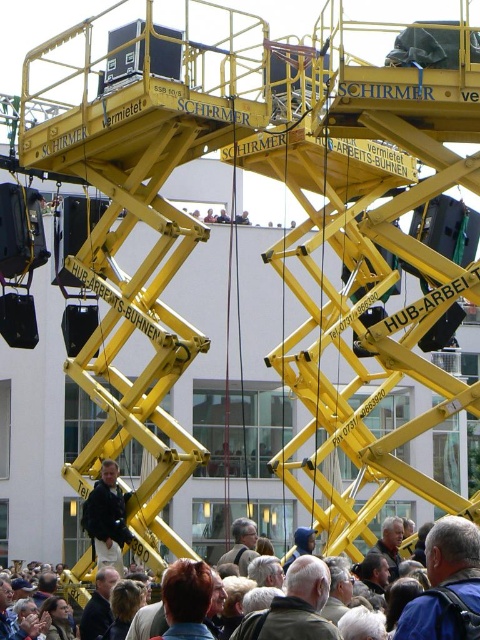
Question: Does matte black crowd at lower center appear on the left side of dark blue jacket at center?

Choices:
 (A) no
 (B) yes

Answer: (A)

Question: Can you confirm if matte black crowd at lower center is wider than dark blue jacket at center?

Choices:
 (A) yes
 (B) no

Answer: (A)

Question: Which of the following is the closest to the observer?

Choices:
 (A) matte black crowd at lower center
 (B) dark blue jacket at center

Answer: (A)

Question: Is matte black crowd at lower center positioned in front of dark blue jacket at center?

Choices:
 (A) no
 (B) yes

Answer: (B)